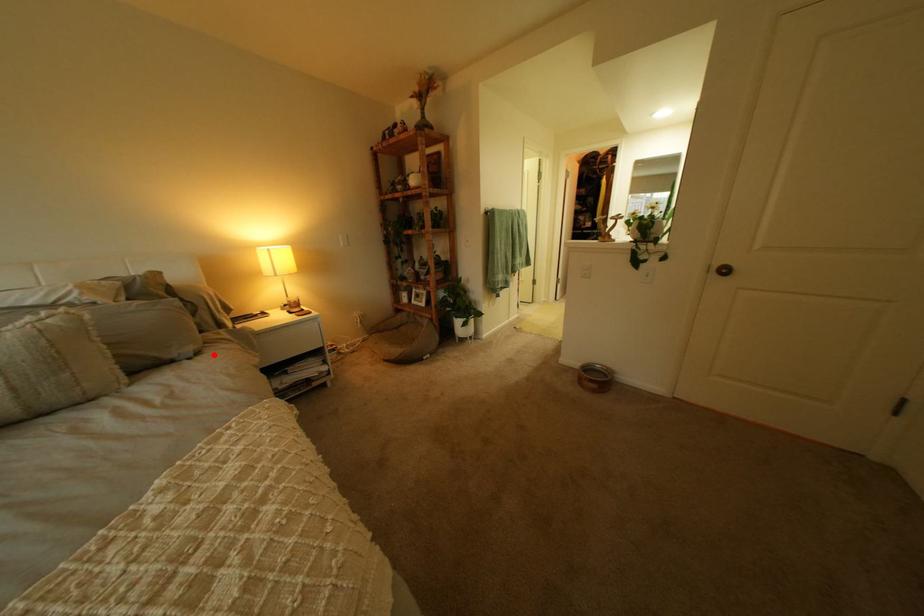
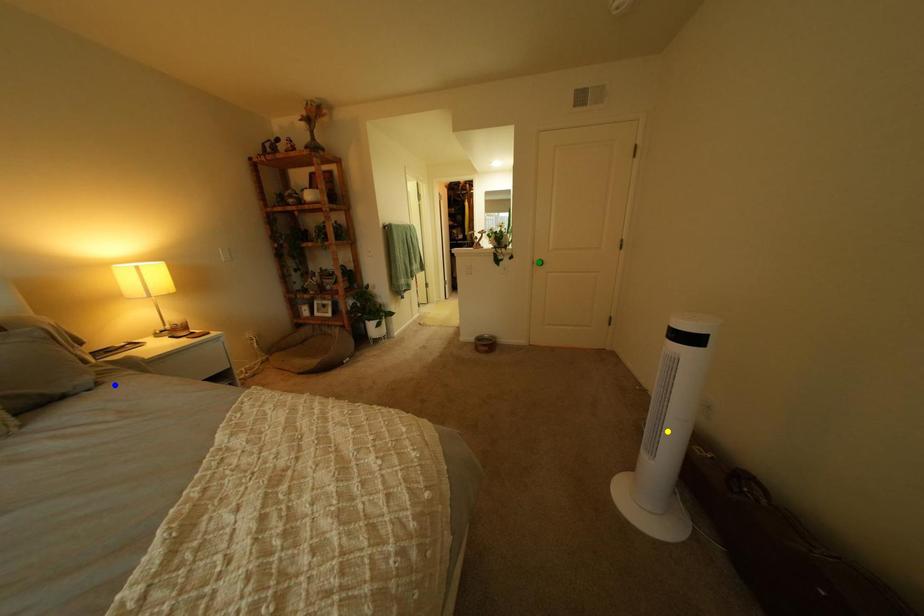
Question: I am providing you with two images of the same scene from different viewpoints. A red point is marked on the first image. You are given multiple points on the second image. Which point in image 2 is actually the same real-world point as the red point in image 1?

Choices:
 (A) yellow point
 (B) blue point
 (C) green point

Answer: (B)